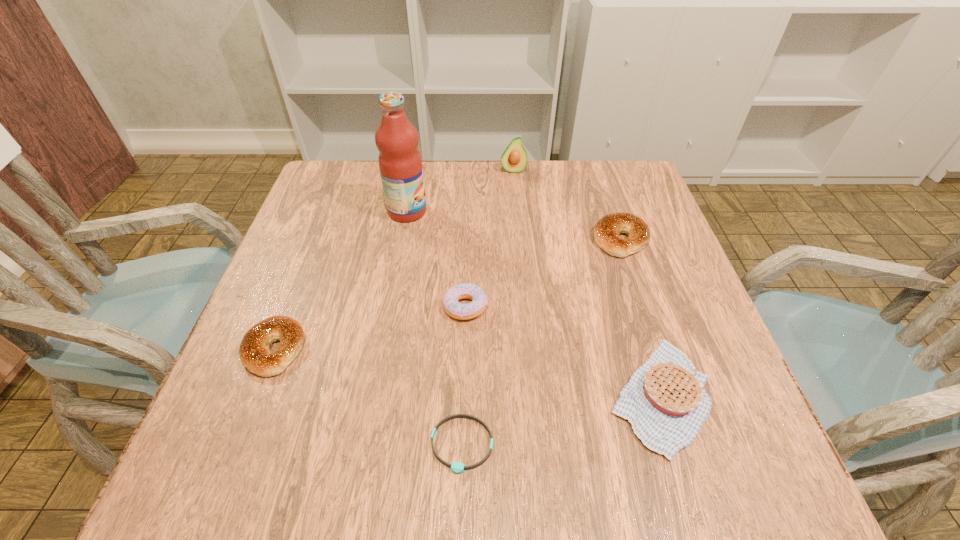
This screenshot has width=960, height=540. I want to click on vacant region located on the front label of the sixth object from right to left, so click(570, 211).

This screenshot has height=540, width=960. In order to click on blank space located 0.240m on the cut side of the avocado in this screenshot , I will do `click(518, 231)`.

The width and height of the screenshot is (960, 540). What are the coordinates of `vacant region located 0.230m on the left of the farther bagel` in the screenshot? It's located at 495,239.

Where is `free space located on the left of the doughnut`? This screenshot has height=540, width=960. free space located on the left of the doughnut is located at coordinates (398, 307).

Where is `vacant area situated 0.050m on the front of the nearer bagel`? vacant area situated 0.050m on the front of the nearer bagel is located at coordinates pyautogui.click(x=252, y=405).

I want to click on vacant space positioned 0.070m on the left of the pie, so [566, 396].

Identify the location of fruit juice that is at the far edge. (400, 163).

Find the location of `avocado at the far edge`. avocado at the far edge is located at coordinates (514, 159).

Find the location of `pie positioned at the near edge`. pie positioned at the near edge is located at coordinates (665, 401).

I want to click on wristband present at the near edge, so click(456, 467).